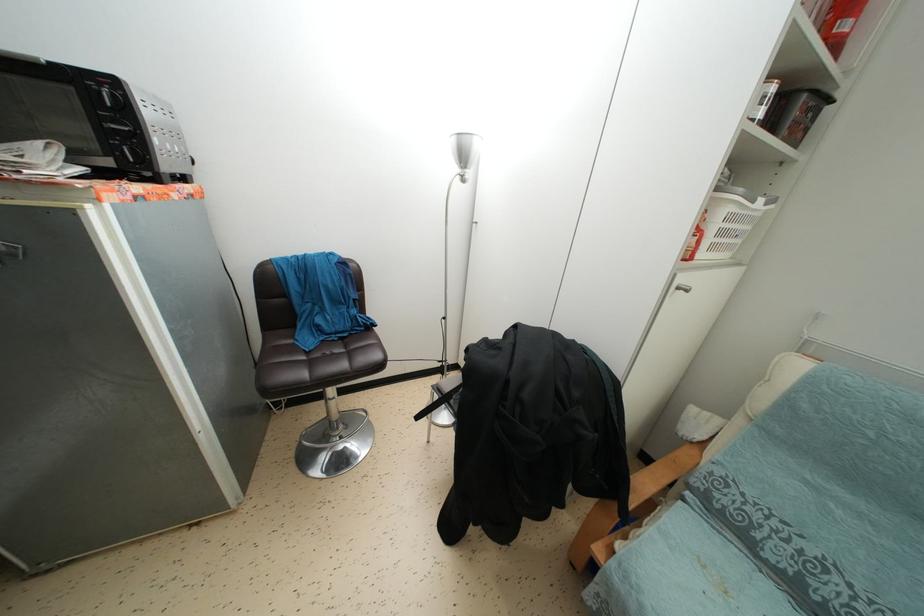
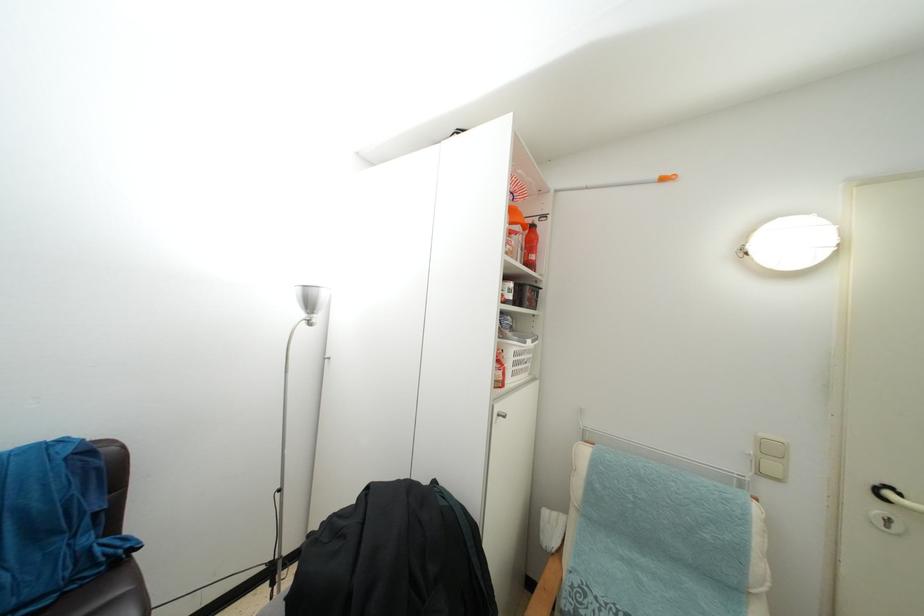
In the scene shown: The images are taken continuously from a first-person perspective. In which direction is your viewpoint rotating?

The rotation direction of the camera is right-up.